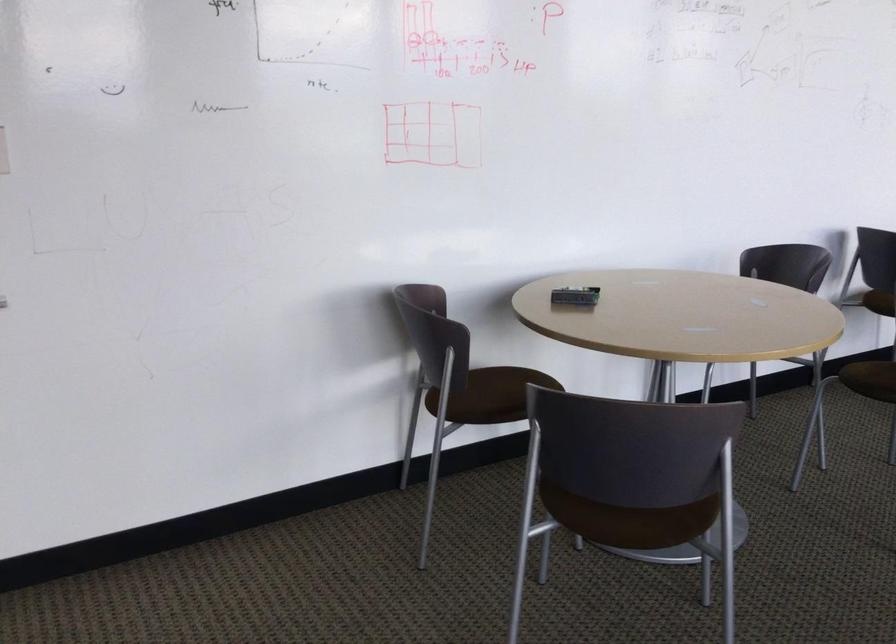
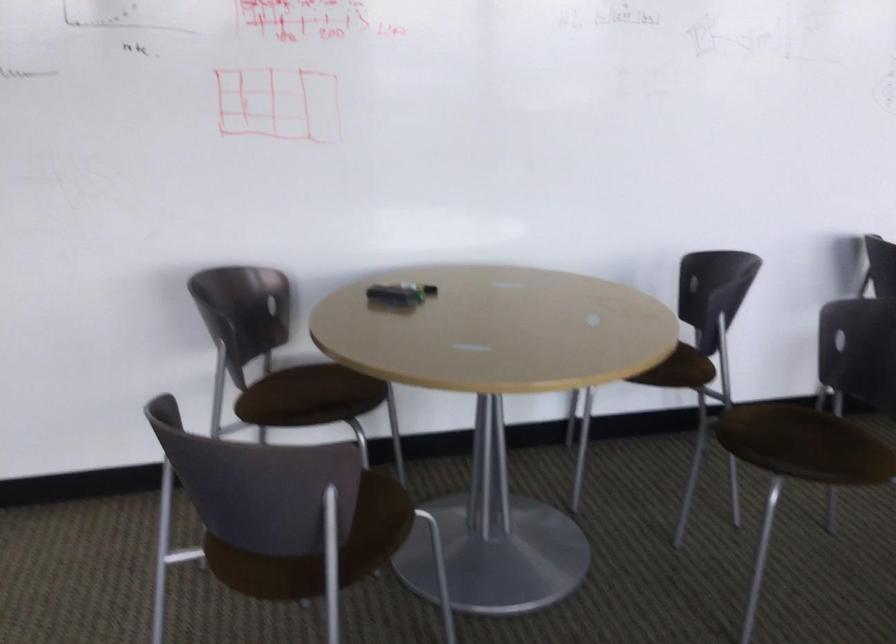
Question: The camera is either moving clockwise (left) or counter-clockwise (right) around the object. The first image is from the beginning of the video and the second image is from the end. Is the camera moving left or right when shooting the video?

Choices:
 (A) Left
 (B) Right

Answer: (B)